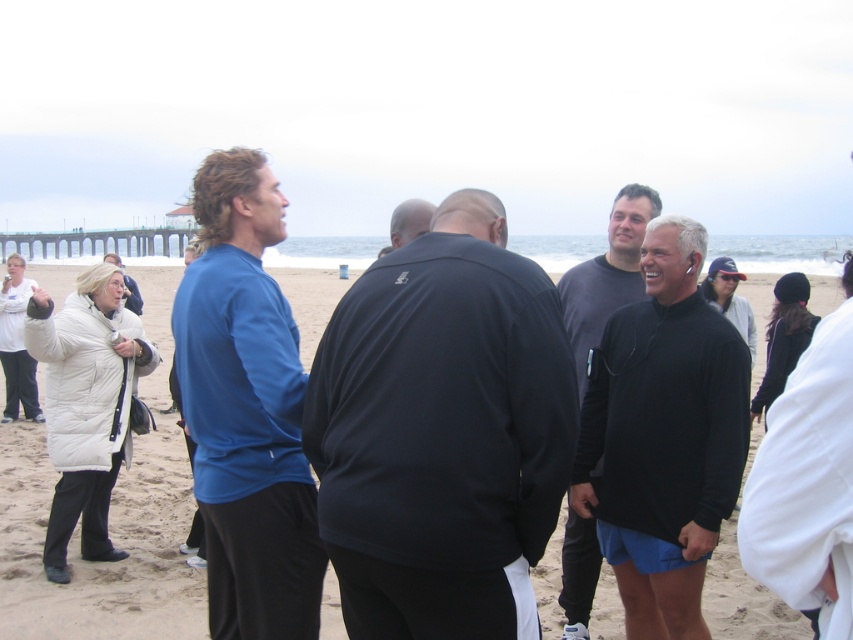
Between matte black jacket at center and dark gray sweatshirt at center, which one is positioned lower?

matte black jacket at center is below.

Which of these two, matte black jacket at center or dark gray sweatshirt at center, stands taller?

matte black jacket at center

Between point (534, 547) and point (424, 202), which one is positioned behind?

The point (424, 202) is more distant.

Locate an element on the screen. matte black jacket at center is located at coordinates (442, 433).

Looking at this image, is the position of blue fleece jacket at center less distant than that of dark gray sweatshirt at center?

That is True.

Who is lower down, blue fleece jacket at center or dark gray sweatshirt at center?

blue fleece jacket at center is lower down.

In order to click on blue fleece jacket at center in this screenshot , I will do `click(247, 410)`.

Is dark gray sweater at center further to camera compared to dark gray sweatshirt at center?

No.

Measure the distance between point (642,296) and camera.

The distance of point (642,296) from camera is 118.96 feet.

This screenshot has height=640, width=853. What do you see at coordinates (607, 275) in the screenshot?
I see `dark gray sweater at center` at bounding box center [607, 275].

In order to click on dark gray sweater at center in this screenshot , I will do pyautogui.click(x=607, y=275).